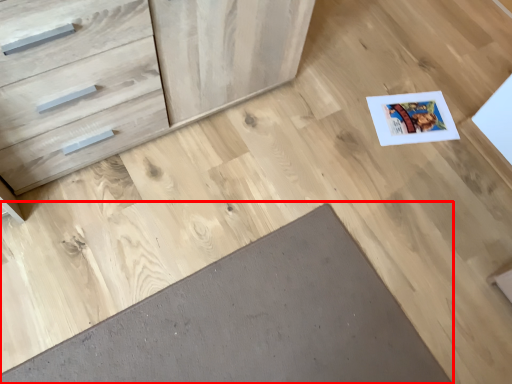
Question: From the image's perspective, where is doormat (annotated by the red box) located relative to chest of drawers?

Choices:
 (A) below
 (B) above

Answer: (A)